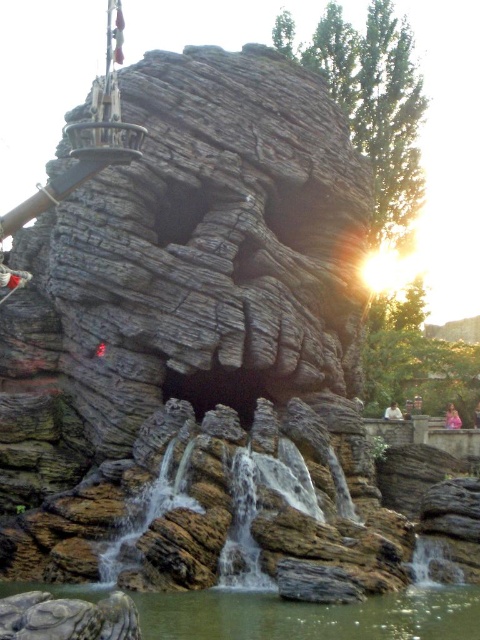
Question: Which object is closer to the camera taking this photo?

Choices:
 (A) pink fabric person at lower right
 (B) light brown hair at center
 (C) greenish water at lower center

Answer: (C)

Question: Which point is closer to the camera?

Choices:
 (A) (391, 410)
 (B) (448, 417)

Answer: (A)

Question: Is greenish water at lower center positioned at the back of pink fabric person at lower right?

Choices:
 (A) no
 (B) yes

Answer: (A)

Question: Can you confirm if greenish water at lower center is smaller than light brown hair at center?

Choices:
 (A) no
 (B) yes

Answer: (A)

Question: Can you confirm if greenish water at lower center is positioned below light brown hair at center?

Choices:
 (A) yes
 (B) no

Answer: (A)

Question: Among these objects, which one is farthest from the camera?

Choices:
 (A) pink fabric person at lower right
 (B) greenish water at lower center
 (C) light brown hair at center

Answer: (A)